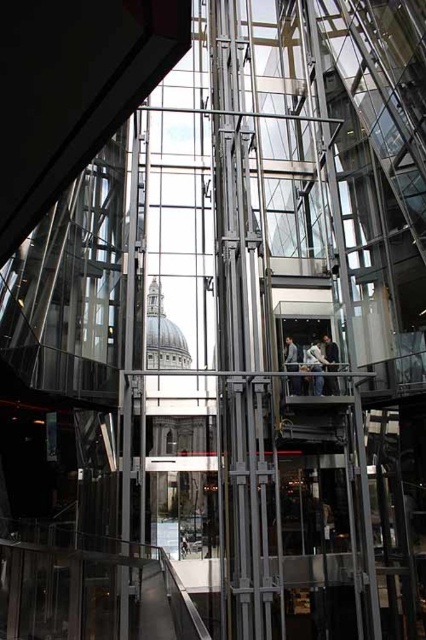
Does point (313, 358) lie in front of point (287, 355)?

Yes, point (313, 358) is closer to viewer.

Does light beige fabric jacket at center appear on the right side of light gray fabric jacket at center?

Yes, light beige fabric jacket at center is to the right of light gray fabric jacket at center.

Does point (322, 387) lie in front of point (285, 362)?

Yes, point (322, 387) is closer to viewer.

Locate an element on the screen. This screenshot has height=640, width=426. light beige fabric jacket at center is located at coordinates (316, 365).

Who is lower down, dark gray fabric jacket at center or light gray fabric jacket at center?

light gray fabric jacket at center

Locate an element on the screen. This screenshot has height=640, width=426. dark gray fabric jacket at center is located at coordinates (331, 353).

The width and height of the screenshot is (426, 640). Describe the element at coordinates (331, 353) in the screenshot. I see `dark gray fabric jacket at center` at that location.

In order to click on dark gray fabric jacket at center in this screenshot , I will do `click(331, 353)`.

Can you confirm if light beige fabric jacket at center is positioned to the right of dark gray fabric jacket at center?

Incorrect, light beige fabric jacket at center is not on the right side of dark gray fabric jacket at center.

Looking at this image, is the position of light beige fabric jacket at center less distant than that of dark gray fabric jacket at center?

No.

The height and width of the screenshot is (640, 426). I want to click on light beige fabric jacket at center, so click(x=316, y=365).

Identify the location of light beige fabric jacket at center. The width and height of the screenshot is (426, 640). (316, 365).